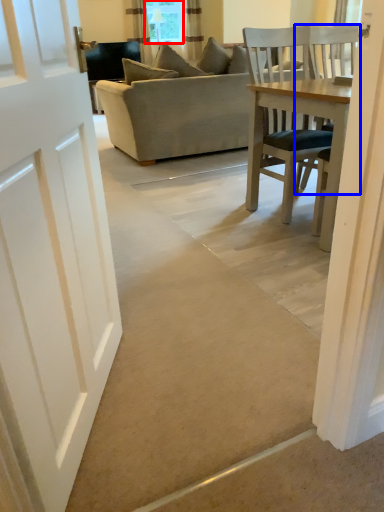
Question: Which point is closer to the camera, window screen (highlighted by a red box) or chair (highlighted by a blue box)?

Choices:
 (A) window screen
 (B) chair

Answer: (B)